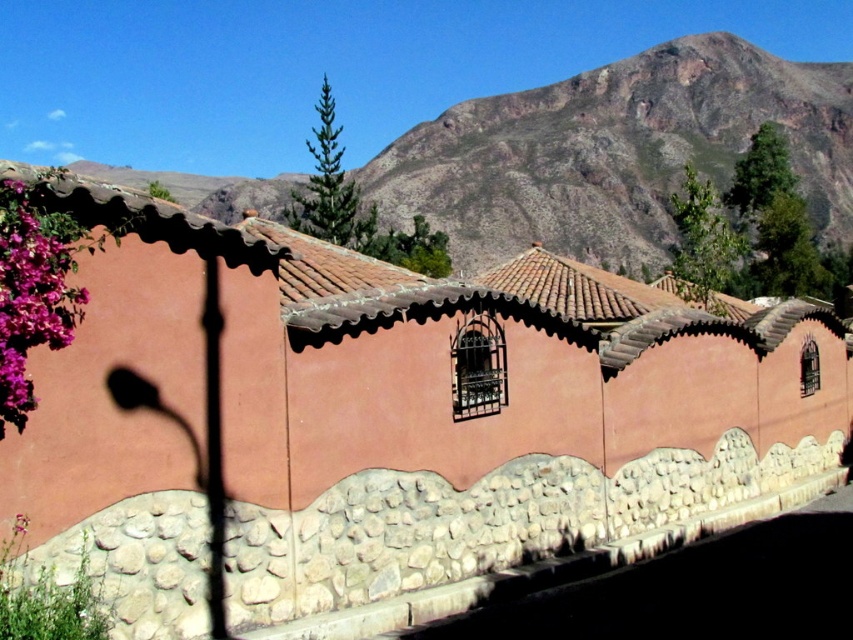
You are a painter standing at the base of the building and want to paint both the brown clay tile roof at center and the pink matte flowers at left. If your ladder can reach up to 5 meters, can you comfortably reach both objects without moving the ladder?

The brown clay tile roof at center and pink matte flowers at left are 4.88 meters apart, so yes, the painter can comfortably reach both objects without moving the ladder since the distance between them is within the ladder reach limit.

You are a painter standing at the front of the building. You need to paint both the brown clay tile roof at center and the pink matte flowers at left. Which object should you look up to paint first?

The brown clay tile roof at center is taller than the pink matte flowers at left, so you should look up to paint the brown clay tile roof at center first before the pink matte flowers at left.

You are a painter standing in front of the building and want to paint the pink matte flowers at left and the brown clay tile roof at center. Which object should you focus on first if you want to paint the one that is closer to you?

The brown clay tile roof at center is closer to you than the pink matte flowers at left, so you should focus on painting the brown clay tile roof at center first.